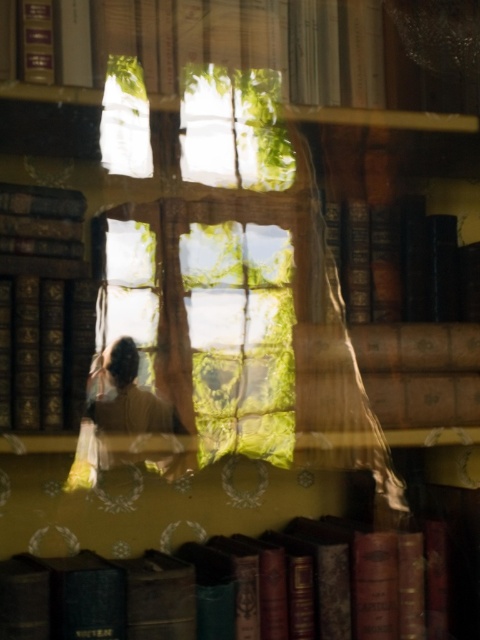
Question: Is dark brown leather book at lower center to the left of matte gold book at upper center from the viewer's perspective?

Choices:
 (A) yes
 (B) no

Answer: (B)

Question: Does matte gold book at upper center have a lesser width compared to light brown fabric at center?

Choices:
 (A) yes
 (B) no

Answer: (B)

Question: Which point appears closest to the camera in this image?

Choices:
 (A) (456, 257)
 (B) (12, 320)
 (C) (94, 481)

Answer: (B)

Question: Estimate the real-world distances between objects in this image. Which object is closer to the matte gold book at upper center?

Choices:
 (A) dark brown leather book at lower center
 (B) hardcover book at center

Answer: (B)

Question: Which object is positioned farthest from the dark brown leather book at lower center?

Choices:
 (A) light brown fabric at center
 (B) matte gold book at upper center

Answer: (B)

Question: Is hardcover book at left above light brown fabric at center?

Choices:
 (A) yes
 (B) no

Answer: (A)